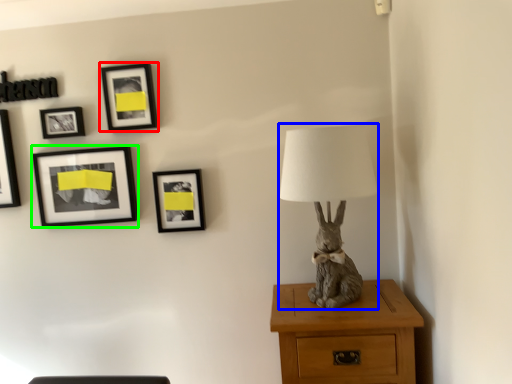
Question: Estimate the real-world distances between objects in this image. Which object is farther from picture frame (highlighted by a red box), table lamp (highlighted by a blue box) or picture frame (highlighted by a green box)?

Choices:
 (A) table lamp
 (B) picture frame

Answer: (A)